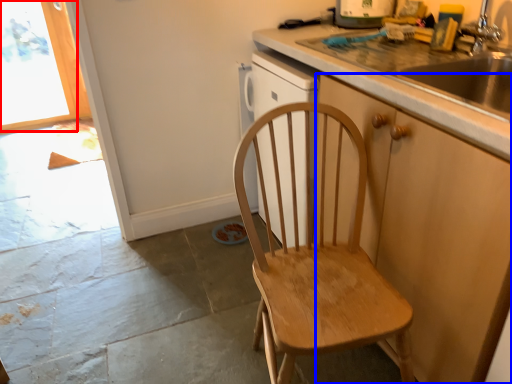
Question: Which object is further to the camera taking this photo, window (highlighted by a red box) or cabinetry (highlighted by a blue box)?

Choices:
 (A) window
 (B) cabinetry

Answer: (A)